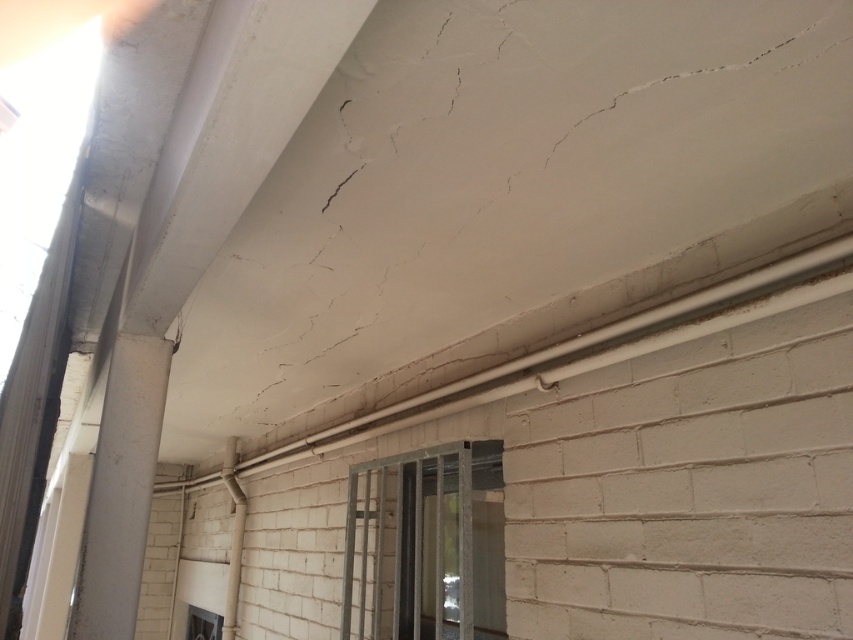
You are a window installer examining the building exterior. You need to replace the metallic gray window at center and the transparent glass window at lower left. Which window should you replace first if you start from the left side of the building?

You should replace the transparent glass window at lower left first because the metallic gray window at center is positioned on the right side of it, so starting from the left, you encounter the transparent glass window at lower left before the metallic gray window at center.

You are an architect inspecting the building facade. You notice two windows, the metallic gray window at center and the transparent glass window at lower left. Which window has a greater width?

The metallic gray window at center is wider than the transparent glass window at lower left according to the description.

You are standing at the corner of the building looking at the ceiling and wall. There are two points marked on the image, point 1 at coordinates point (502, 554) and point 2 at coordinates point (210, 625). Which point appears closer to you?

Point (502, 554) is closer to the camera than point (210, 625), so point 1 appears closer to you.